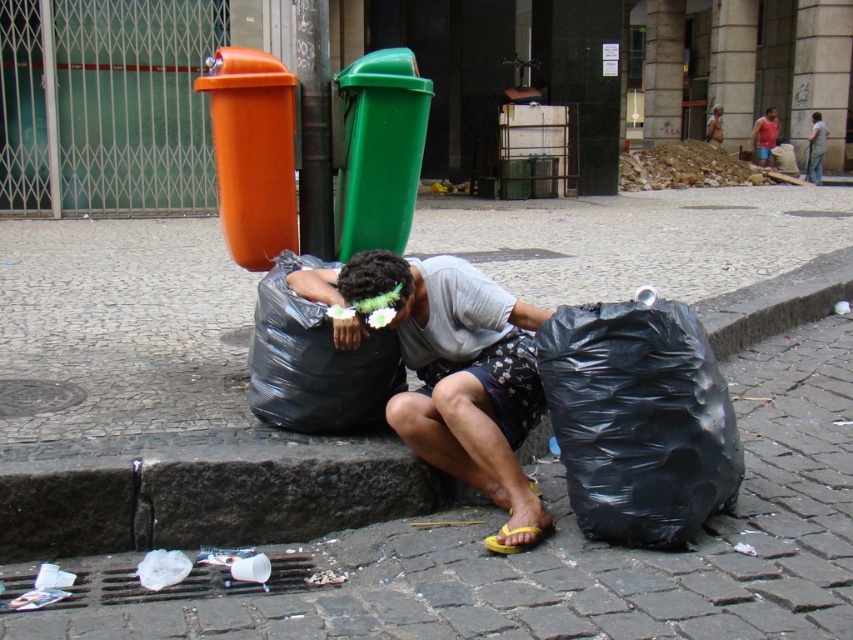
Does point (590, 504) lie behind point (448, 422)?

No, (590, 504) is closer to viewer.

Who is lower down, black plastic bag at lower right or gray fabric shirt at center?

black plastic bag at lower right is below.

I want to click on black plastic bag at lower right, so click(637, 419).

Can you confirm if black plastic bag at lower right is taller than matte pink shirt at upper right?

Incorrect, black plastic bag at lower right's height is not larger of matte pink shirt at upper right's.

This screenshot has height=640, width=853. What do you see at coordinates (637, 419) in the screenshot? I see `black plastic bag at lower right` at bounding box center [637, 419].

Locate an element on the screen. black plastic bag at lower right is located at coordinates (637, 419).

Who is more distant from viewer, (117,630) or (807,157)?

The point (807,157) is more distant.

Does cobblestone pavement at center have a greater width compared to dark gray fabric shirt at center?

Indeed, cobblestone pavement at center has a greater width compared to dark gray fabric shirt at center.

Locate an element on the screen. cobblestone pavement at center is located at coordinates (161, 403).